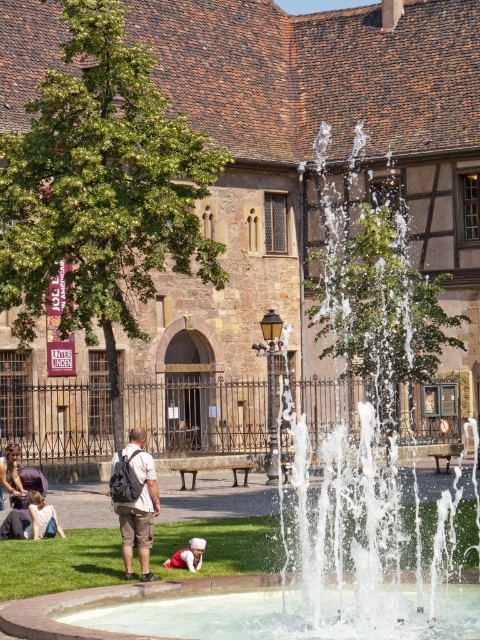
Does point (146, 488) lie behind point (0, 538)?

No, (146, 488) is in front of (0, 538).

Which is below, matte black backpack at center or denim jacket at lower left?

denim jacket at lower left

Where is `matte black backpack at center`? matte black backpack at center is located at coordinates (137, 506).

Is matte black backpack at center wider than matte black backpack at lower left?

No.

Does point (141, 461) lie in front of point (8, 449)?

That is True.

Identify the location of matte black backpack at center. This screenshot has height=640, width=480. (137, 506).

Can you confirm if green grass lawn at center is taller than matte black backpack at center?

Incorrect, green grass lawn at center's height is not larger of matte black backpack at center's.

Does green grass lawn at center come behind matte black backpack at center?

No.

Does point (423, 528) come farther from viewer compared to point (131, 552)?

That is True.

Locate an element on the screen. This screenshot has width=480, height=640. green grass lawn at center is located at coordinates (60, 563).